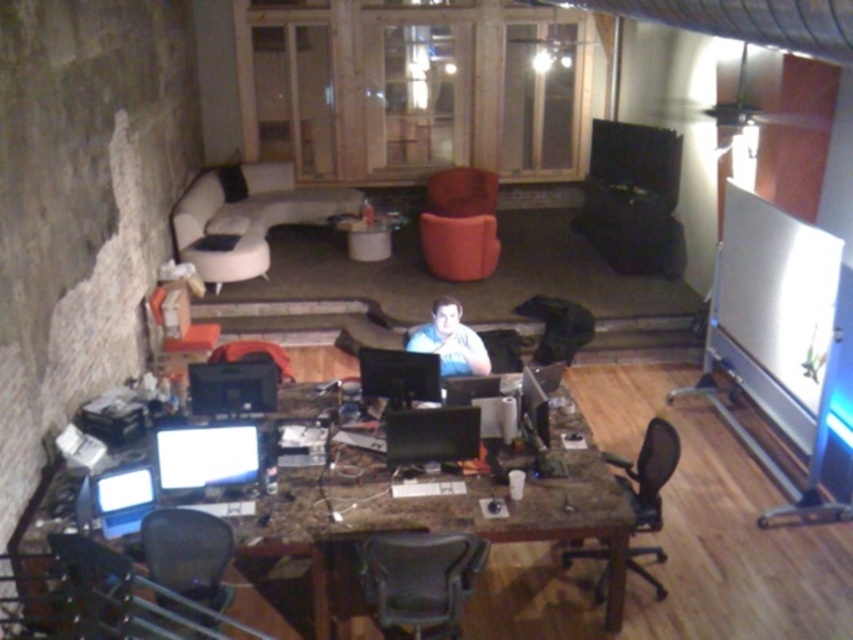
Looking at this image, can you confirm if velvet orange armchair at center is thinner than light blue shirt at center?

Incorrect, velvet orange armchair at center's width is not less than light blue shirt at center's.

Consider the image. Between velvet orange armchair at center and light blue shirt at center, which one appears on the right side from the viewer's perspective?

velvet orange armchair at center is more to the right.

Is point (477, 208) closer to camera compared to point (442, 316)?

No, it is not.

In order to click on velvet orange armchair at center in this screenshot , I will do 460,224.

Consider the image. Which is more to the left, white leather couch at upper left or light blue shirt at center?

Positioned to the left is white leather couch at upper left.

Based on the photo, who is more forward, (x=271, y=212) or (x=440, y=312)?

Point (x=440, y=312) is more forward.

Is point (219, 202) farther from viewer compared to point (434, 307)?

Yes, it is behind point (434, 307).

Locate an element on the screen. Image resolution: width=853 pixels, height=640 pixels. white leather couch at upper left is located at coordinates (247, 216).

Is black plastic chair at lower left shorter than matte black chair at lower left?

Incorrect, black plastic chair at lower left's height does not fall short of matte black chair at lower left's.

Does black plastic chair at lower left have a larger size compared to matte black chair at lower left?

Indeed, black plastic chair at lower left has a larger size compared to matte black chair at lower left.

This screenshot has width=853, height=640. Find the location of `black plastic chair at lower left`. black plastic chair at lower left is located at coordinates (131, 598).

Image resolution: width=853 pixels, height=640 pixels. Identify the location of black plastic chair at lower left. click(x=131, y=598).